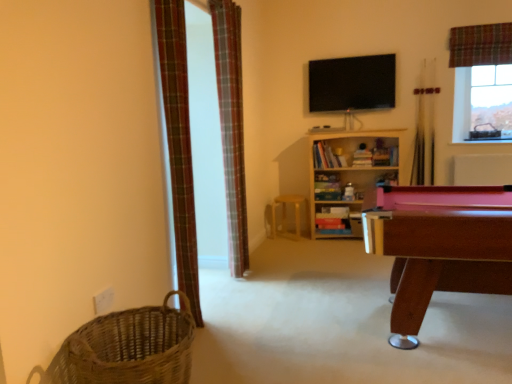
Question: In the image, is wooden stool at center positioned in front of or behind plaid fabric curtain at upper right, marked as the first curtain in a right-to-left arrangement?

Choices:
 (A) behind
 (B) front

Answer: (A)

Question: Considering the positions of wooden stool at center and plaid fabric curtain at upper right, which appears as the 1th curtain when viewed from the back, in the image, is wooden stool at center bigger or smaller than plaid fabric curtain at upper right, which appears as the 1th curtain when viewed from the back,?

Choices:
 (A) big
 (B) small

Answer: (A)

Question: Estimate the real-world distances between objects in this image. Which object is farther from the wooden pool table at right?

Choices:
 (A) plaid fabric curtain at upper right, placed as the 3th curtain when sorted from front to back
 (B) plaid fabric curtain at center, positioned as the 2th curtain in right-to-left order
 (C) woven brown basket at lower left
 (D) wooden bookshelf at center
 (E) wooden stool at center

Answer: (A)

Question: Which of these objects is positioned farthest from the wooden stool at center?

Choices:
 (A) wooden pool table at right
 (B) plaid fabric curtain at upper right, the 3th curtain viewed from the left
 (C) plaid fabric curtain at center, marked as the second curtain in a back-to-front arrangement
 (D) wooden bookshelf at center
 (E) woven brown basket at lower left

Answer: (E)